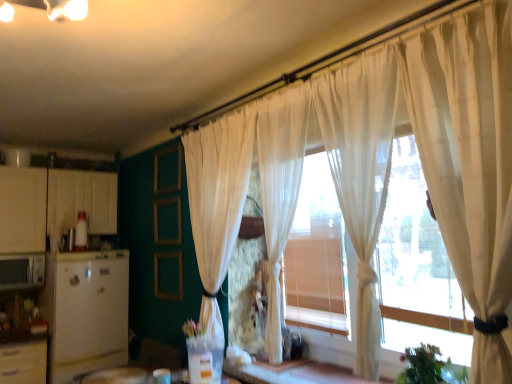
Question: Can you confirm if white matte refrigerator at left, which appears as the first appliance when viewed from the right, is thinner than matte white microwave at left, the first appliance positioned from the left?

Choices:
 (A) yes
 (B) no

Answer: (B)

Question: Does white matte refrigerator at left, positioned as the second appliance in left-to-right order, have a greater height compared to matte white microwave at left, the first appliance positioned from the left?

Choices:
 (A) no
 (B) yes

Answer: (B)

Question: Can we say white matte refrigerator at left, positioned as the second appliance in left-to-right order, lies outside matte white microwave at left, the first appliance positioned from the left?

Choices:
 (A) yes
 (B) no

Answer: (A)

Question: Does white matte refrigerator at left, positioned as the second appliance in left-to-right order, turn towards matte white microwave at left, the first appliance positioned from the left?

Choices:
 (A) no
 (B) yes

Answer: (A)

Question: Is white matte refrigerator at left, which appears as the first appliance when viewed from the right, facing away from matte white microwave at left, the first appliance positioned from the left?

Choices:
 (A) no
 (B) yes

Answer: (A)

Question: Considering the relative positions of white matte refrigerator at left, which appears as the first appliance when viewed from the right, and matte white microwave at left, the first appliance positioned from the left, in the image provided, is white matte refrigerator at left, which appears as the first appliance when viewed from the right, in front of matte white microwave at left, the first appliance positioned from the left,?

Choices:
 (A) yes
 (B) no

Answer: (A)

Question: Can you confirm if translucent wood window frame at center is thinner than white matte refrigerator at left, which appears as the first appliance when viewed from the right?

Choices:
 (A) yes
 (B) no

Answer: (A)

Question: Is translucent wood window frame at center to the left of white matte refrigerator at left, positioned as the second appliance in left-to-right order, from the viewer's perspective?

Choices:
 (A) yes
 (B) no

Answer: (B)

Question: Is translucent wood window frame at center shorter than white matte refrigerator at left, positioned as the second appliance in left-to-right order?

Choices:
 (A) yes
 (B) no

Answer: (B)

Question: Is translucent wood window frame at center aimed at white matte refrigerator at left, positioned as the second appliance in left-to-right order?

Choices:
 (A) yes
 (B) no

Answer: (B)

Question: Can you confirm if translucent wood window frame at center is wider than white matte refrigerator at left, positioned as the second appliance in left-to-right order?

Choices:
 (A) no
 (B) yes

Answer: (A)

Question: Can you confirm if translucent wood window frame at center is smaller than white matte refrigerator at left, positioned as the second appliance in left-to-right order?

Choices:
 (A) no
 (B) yes

Answer: (A)

Question: From the image's perspective, is sheer white curtain at center, the first curtain in the left-to-right sequence, on top of white matte refrigerator at left, positioned as the second appliance in left-to-right order?

Choices:
 (A) yes
 (B) no

Answer: (A)